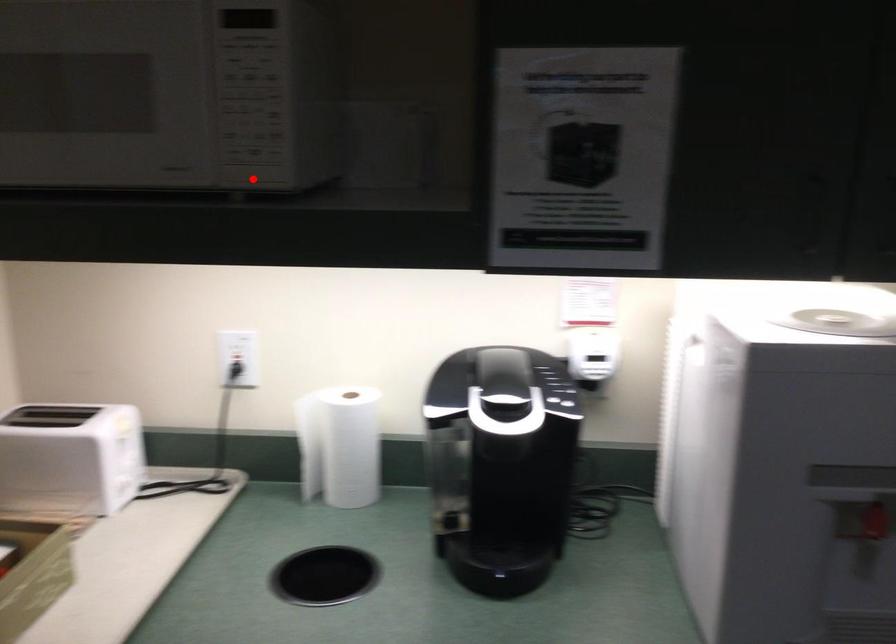
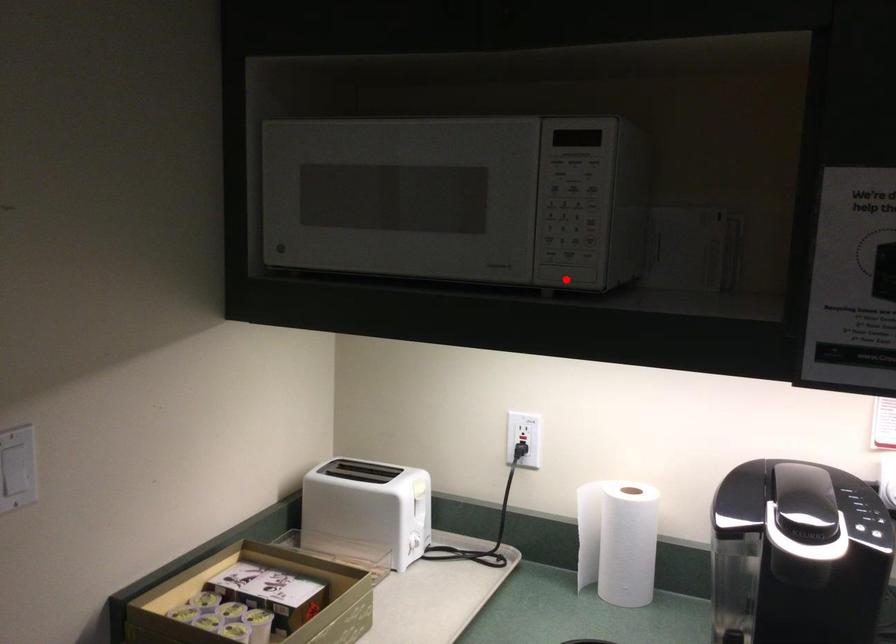
I am providing you with two images of the same scene from different viewpoints. A red point is marked on the first image and another point is marked on the second image. Is the red point in image1 aligned with the point shown in image2?

Yes